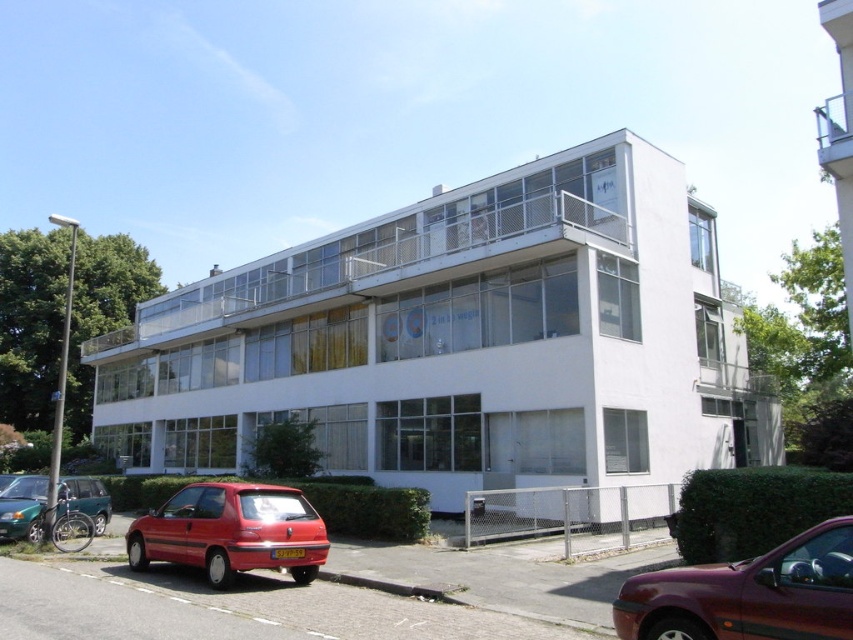
Can you confirm if maroon metallic car at lower right is bigger than matte red hatchback at lower left?

Correct, maroon metallic car at lower right is larger in size than matte red hatchback at lower left.

Between maroon metallic car at lower right and matte red hatchback at lower left, which one appears on the left side from the viewer's perspective?

Positioned to the left is matte red hatchback at lower left.

Find the location of a particular element. This screenshot has height=640, width=853. maroon metallic car at lower right is located at coordinates pyautogui.click(x=747, y=593).

Is clear glass balcony at center positioned before matte red hatchback at lower left?

No, it is not.

Is clear glass balcony at center thinner than matte red hatchback at lower left?

In fact, clear glass balcony at center might be wider than matte red hatchback at lower left.

Describe the element at coordinates (463, 340) in the screenshot. I see `clear glass balcony at center` at that location.

The width and height of the screenshot is (853, 640). Find the location of `clear glass balcony at center`. clear glass balcony at center is located at coordinates (463, 340).

Does matte red hatchback at lower left have a greater height compared to green matte car at lower left?

No, matte red hatchback at lower left is not taller than green matte car at lower left.

Does matte red hatchback at lower left come in front of green matte car at lower left?

Yes, matte red hatchback at lower left is closer to the viewer.

Find the location of a particular element. Image resolution: width=853 pixels, height=640 pixels. matte red hatchback at lower left is located at coordinates (231, 531).